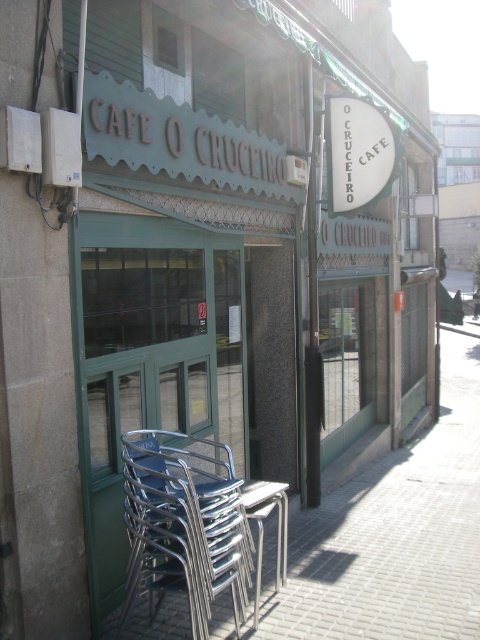
Question: Which object appears farthest from the camera in this image?

Choices:
 (A) metallic silver chair at lower left
 (B) metallic silver pavement at lower left

Answer: (B)

Question: Can you confirm if metallic silver pavement at lower left is positioned to the right of metallic silver chair at lower left?

Choices:
 (A) no
 (B) yes

Answer: (B)

Question: Is metallic silver pavement at lower left closer to the viewer compared to metallic silver chair at lower left?

Choices:
 (A) no
 (B) yes

Answer: (A)

Question: Is metallic silver pavement at lower left thinner than metallic silver chair at lower left?

Choices:
 (A) yes
 (B) no

Answer: (B)